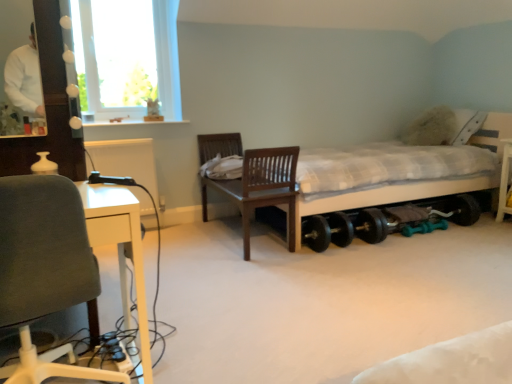
This screenshot has height=384, width=512. Identify the location of free spot to the right of black rubber wheel at lower center. coord(457,233).